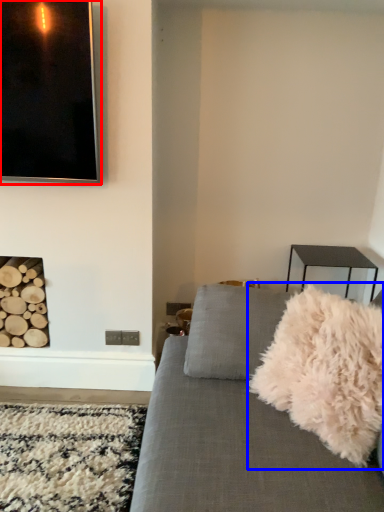
Question: Which of the following is the closest to the observer, picture frame (highlighted by a red box) or throw pillow (highlighted by a blue box)?

Choices:
 (A) picture frame
 (B) throw pillow

Answer: (B)